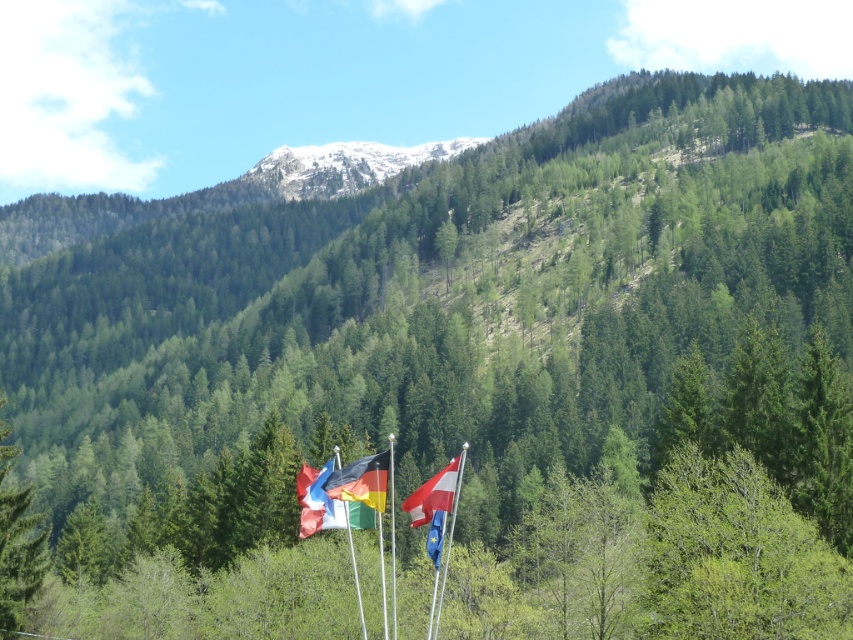
Where is `white fabric flag pole at center`? The image size is (853, 640). white fabric flag pole at center is located at coordinates (453, 516).

Measure the distance between point (283, 196) and camera.

A distance of 1454.31 feet exists between point (283, 196) and camera.

Is point (357, 148) behind point (302, 500)?

Yes.

You are a GUI agent. You are given a task and a screenshot of the screen. Output one action in this format:
    pyautogui.click(x=<x>, y=<y>)
    Task: Click on the white snow-covered mountain at upper center
    The width and height of the screenshot is (853, 640).
    Given the screenshot: What is the action you would take?
    pyautogui.click(x=344, y=164)

This screenshot has height=640, width=853. In order to click on matte black flag at center in this screenshot , I will do `click(361, 481)`.

Does matte black flag at center appear on the right side of blue fabric flag at lower center?

In fact, matte black flag at center is to the left of blue fabric flag at lower center.

Is point (360, 474) less distant than point (439, 513)?

No, (360, 474) is behind (439, 513).

Locate an element on the screen. Image resolution: width=853 pixels, height=640 pixels. matte black flag at center is located at coordinates (361, 481).